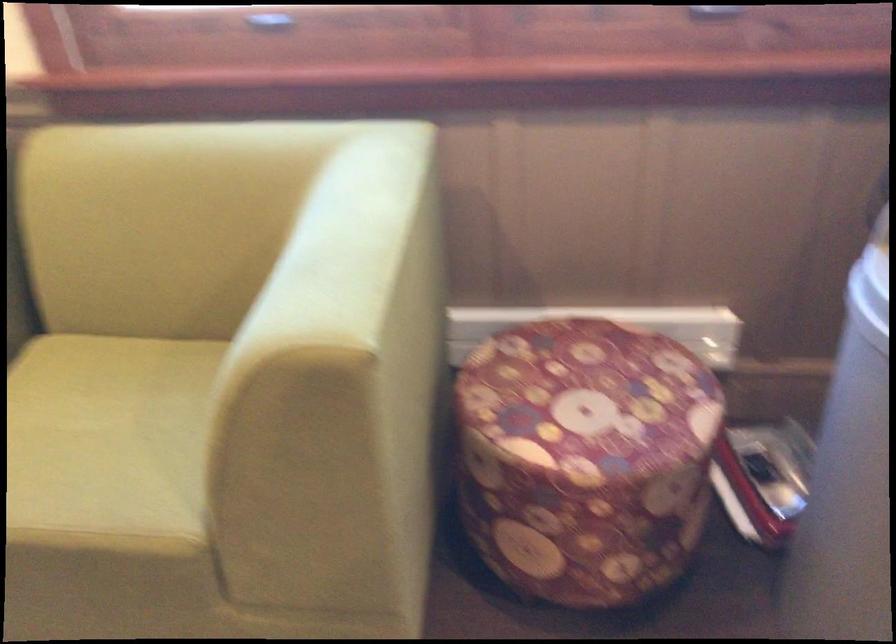
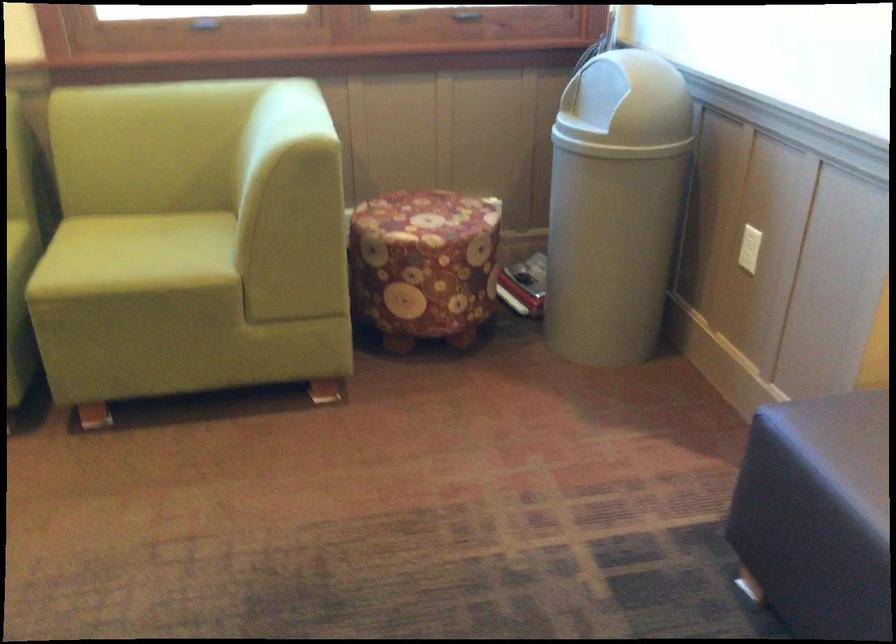
In the second image, find the point that corresponds to point (572, 365) in the first image.

(414, 207)